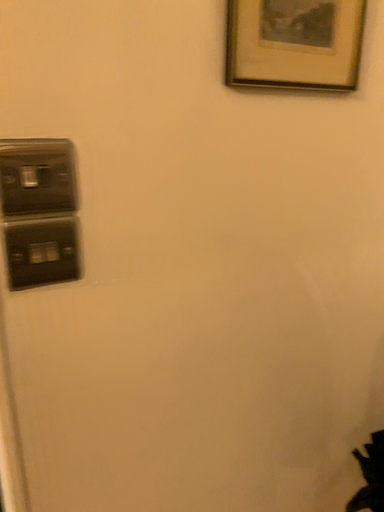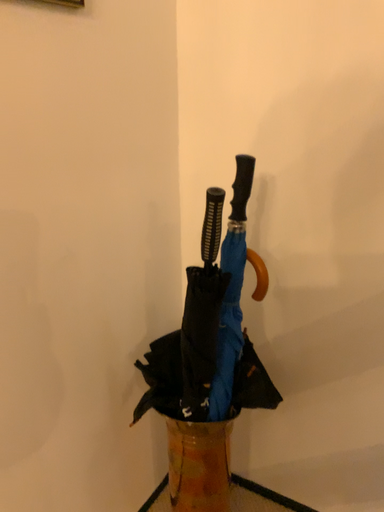
Question: Which way did the camera rotate in the video?

Choices:
 (A) rotated left
 (B) rotated right

Answer: (B)